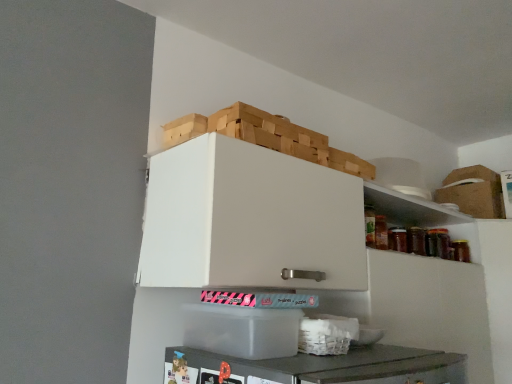
Question: Does transparent plastic container at lower center, which is counted as the first cardboard box, starting from the left, have a lesser width compared to white woven basket at lower center?

Choices:
 (A) no
 (B) yes

Answer: (A)

Question: Is transparent plastic container at lower center, arranged as the 1th cardboard box when ordered from the bottom, not close to white woven basket at lower center?

Choices:
 (A) no
 (B) yes

Answer: (A)

Question: Is transparent plastic container at lower center, positioned as the 2th cardboard box in back-to-front order, surrounding white woven basket at lower center?

Choices:
 (A) yes
 (B) no

Answer: (B)

Question: Can you confirm if transparent plastic container at lower center, arranged as the 1th cardboard box when ordered from the bottom, is shorter than white woven basket at lower center?

Choices:
 (A) no
 (B) yes

Answer: (A)

Question: Is transparent plastic container at lower center, the 2th cardboard box positioned from the top, bigger than white woven basket at lower center?

Choices:
 (A) yes
 (B) no

Answer: (A)

Question: Is wooden crate at upper center spatially inside transparent plastic container at lower center, the 2th cardboard box positioned from the top, or outside of it?

Choices:
 (A) inside
 (B) outside

Answer: (B)

Question: Based on their positions, is wooden crate at upper center located to the left or right of transparent plastic container at lower center, the first cardboard box when ordered from front to back?

Choices:
 (A) right
 (B) left

Answer: (A)

Question: From a real-world perspective, is wooden crate at upper center positioned above or below transparent plastic container at lower center, positioned as the 2th cardboard box in back-to-front order?

Choices:
 (A) above
 (B) below

Answer: (A)

Question: In terms of height, does wooden crate at upper center look taller or shorter compared to transparent plastic container at lower center, which appears as the second cardboard box when viewed from the right?

Choices:
 (A) short
 (B) tall

Answer: (A)

Question: Is point (192, 322) closer or farther from the camera than point (448, 173)?

Choices:
 (A) farther
 (B) closer

Answer: (B)

Question: From the image's perspective, is transparent plastic container at lower center, which is counted as the first cardboard box, starting from the left, positioned above or below brown cardboard box at upper right, the 2th cardboard box in the front-to-back sequence?

Choices:
 (A) above
 (B) below

Answer: (B)

Question: Visually, is transparent plastic container at lower center, the 2th cardboard box positioned from the top, positioned to the left or to the right of brown cardboard box at upper right, which appears as the 2th cardboard box when ordered from the bottom?

Choices:
 (A) right
 (B) left

Answer: (B)

Question: Relative to brown cardboard box at upper right, the 1th cardboard box from the back, is transparent plastic container at lower center, which is counted as the first cardboard box, starting from the left, in front or behind?

Choices:
 (A) behind
 (B) front

Answer: (B)

Question: In terms of width, does brown cardboard box at upper right, the first cardboard box from the top, look wider or thinner when compared to white woven basket at lower center?

Choices:
 (A) thin
 (B) wide

Answer: (B)

Question: Is point (500, 208) positioned closer to the camera than point (330, 354)?

Choices:
 (A) farther
 (B) closer

Answer: (A)